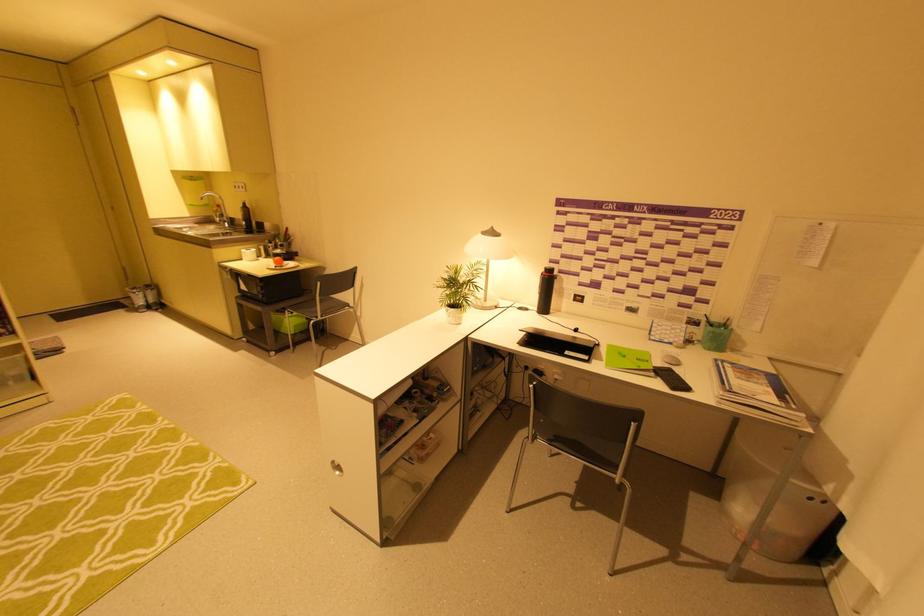
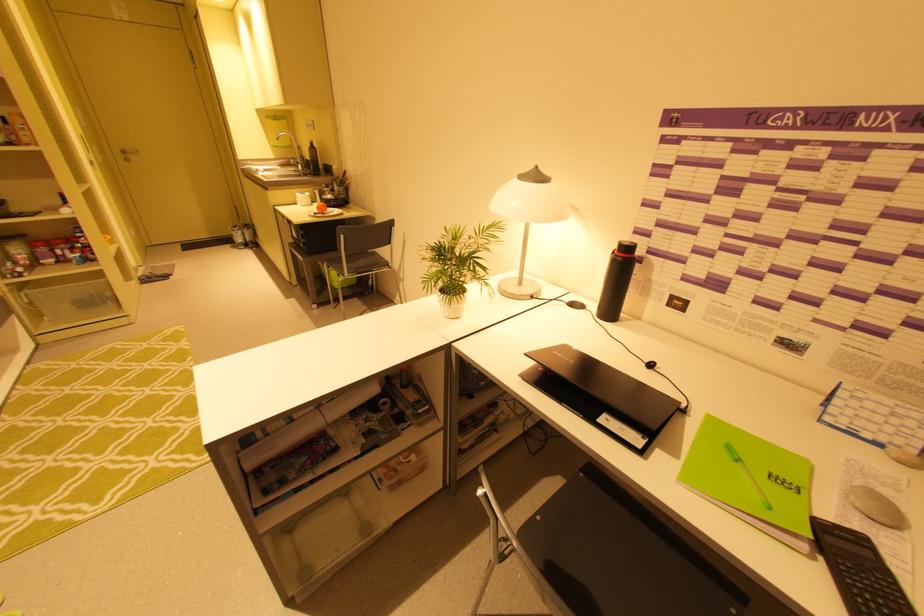
Locate, in the second image, the point that corresponds to (x=454, y=270) in the first image.

(451, 235)